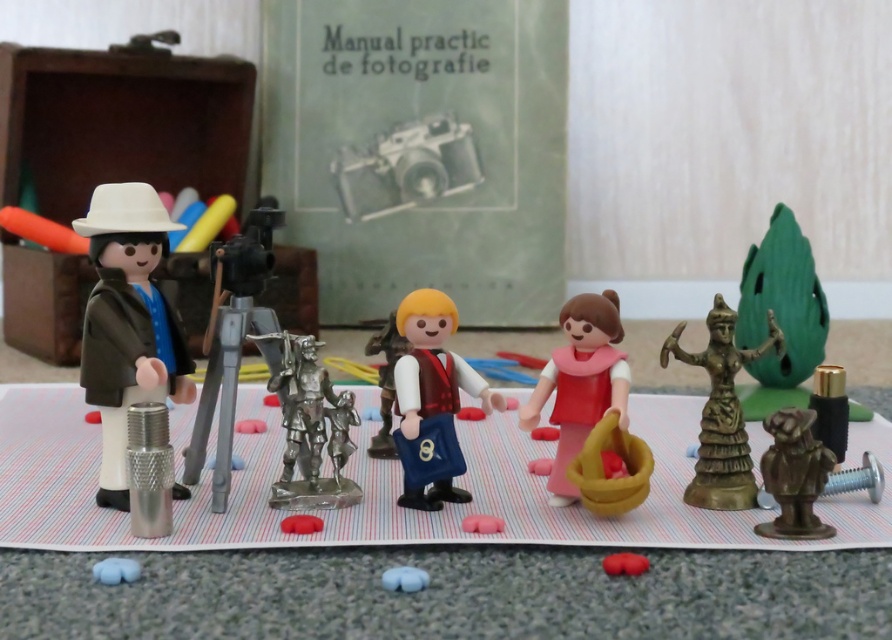
You are a toy organizer who needs to place a new 3.5 inch tall action figure between the pink matte doll at center and the bronze statue at lower right. Can the action figure fit in the space between them?

The distance between the pink matte doll at center and the bronze statue at lower right is 6.59 inches. Since the action figure is only 3.5 inches tall, it can easily fit within that space.

Looking at this image, you are organizing a display and need to place the matte plastic figure at center and the pink matte doll at center on a shelf. Which one should you place first to ensure stability?

The matte plastic figure at center is larger in size than the pink matte doll at center, so it should be placed first on the shelf to ensure stability.

What object is located at the coordinate point (432, 396) in the scene?

The point (432, 396) is on the matte plastic figure at center.